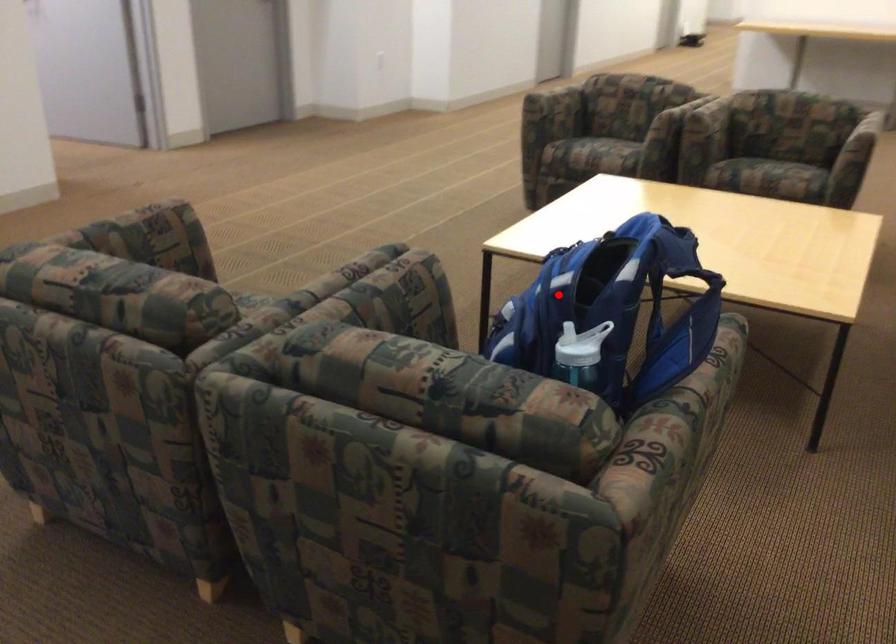
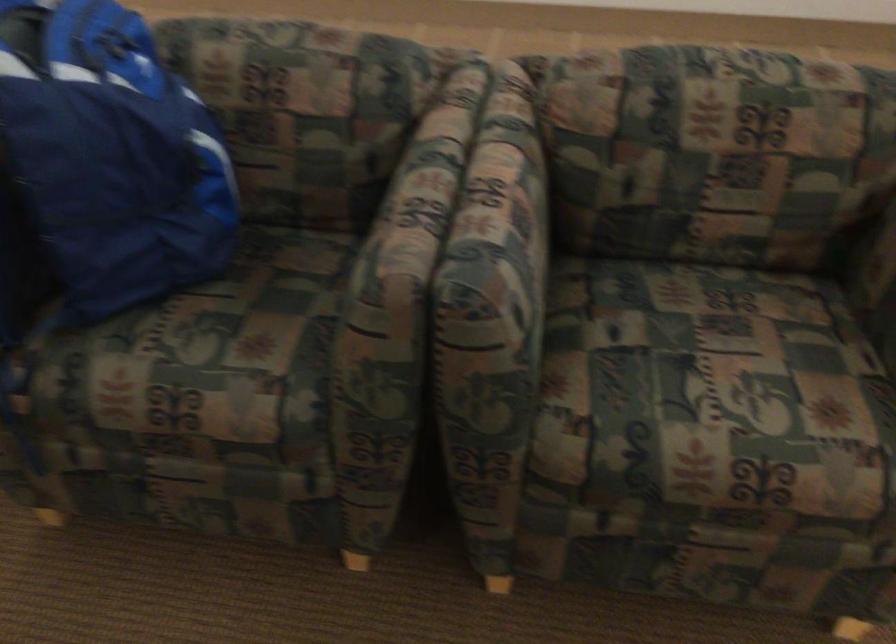
Question: I am providing you with two images of the same scene from different viewpoints. In image1, a red point is highlighted. Considering the same 3D point in image2, which of the following is correct?

Choices:
 (A) It is closer
 (B) It is farther

Answer: (A)